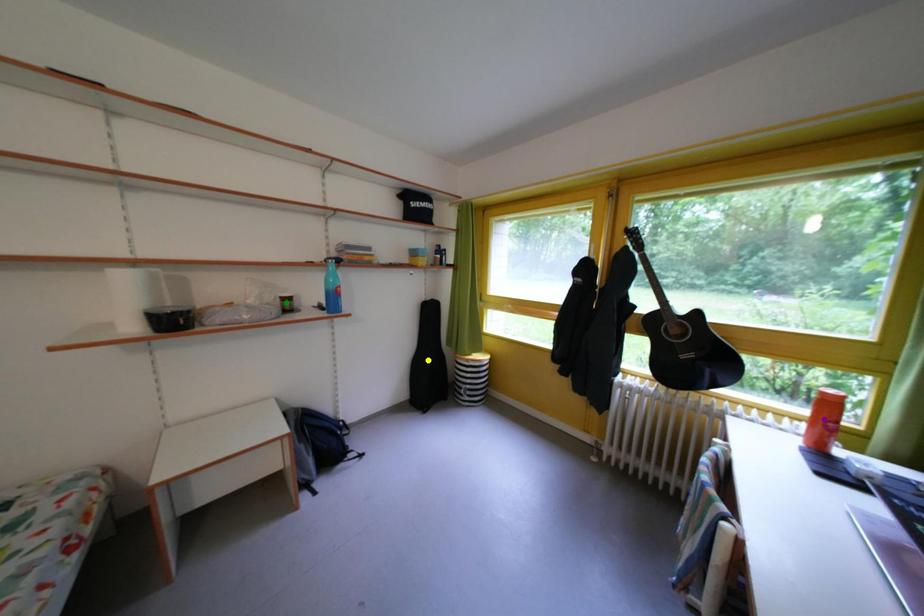
Order these from nearest to farthest:
1. green point
2. yellow point
3. purple point

purple point, green point, yellow point